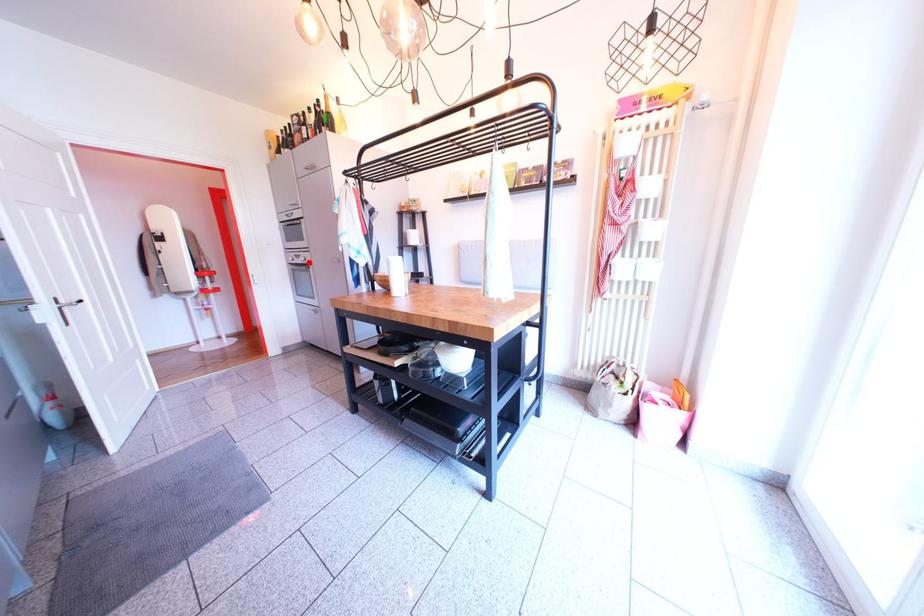
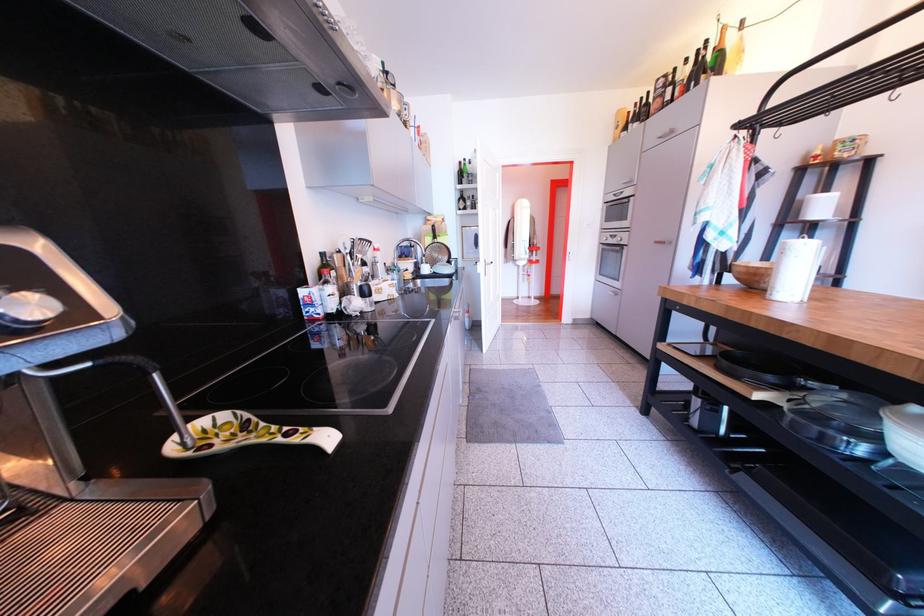
Where in the second image is the point corresponding to the highlighted location from the first image?

(624, 243)